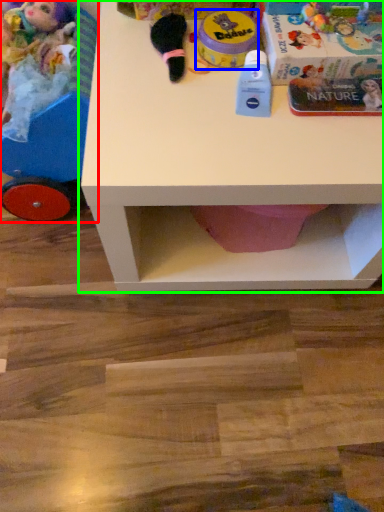
Question: Estimate the real-world distances between objects in this image. Which object is farther from toy (highlighted by a red box), toy (highlighted by a blue box) or table (highlighted by a green box)?

Choices:
 (A) toy
 (B) table

Answer: (A)